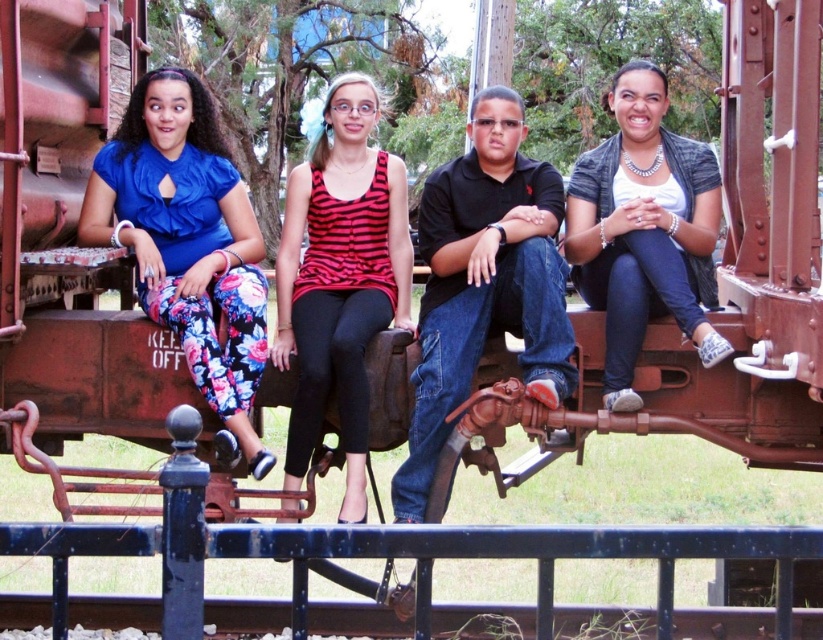
Question: Does blue satin blouse at left have a lesser width compared to striped fabric tank top at center?

Choices:
 (A) no
 (B) yes

Answer: (B)

Question: Which of these objects is positioned farthest from the blue painted metal rail at lower center?

Choices:
 (A) striped fabric tank top at center
 (B) blue satin blouse at left
 (C) denim jeans at center

Answer: (A)

Question: Is blue satin blouse at left in front of striped fabric tank top at center?

Choices:
 (A) yes
 (B) no

Answer: (B)

Question: Based on their relative distances, which object is nearer to the blue satin blouse at left?

Choices:
 (A) striped fabric tank top at center
 (B) blue painted metal rail at lower center
 (C) denim jeans at center

Answer: (C)

Question: Is blue satin blouse at left bigger than denim jeans at center?

Choices:
 (A) no
 (B) yes

Answer: (A)

Question: Which object appears farthest from the camera in this image?

Choices:
 (A) denim jeans at center
 (B) blue satin blouse at left

Answer: (B)